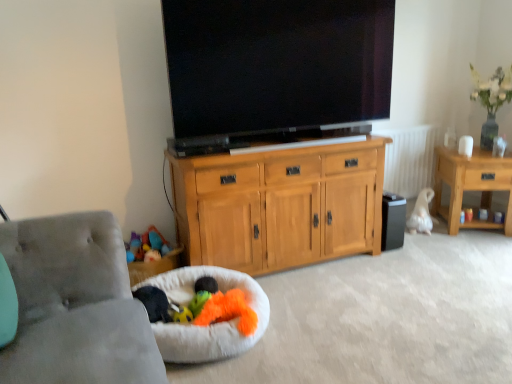
In order to face soft plush toy at lower center, acting as the 1th toy starting from the left, should I rotate leftwards or rightwards?

To align with it, rotate left about 9.523°.

Where is `soft plush toy at lower center, which is the third toy from right to left`? soft plush toy at lower center, which is the third toy from right to left is located at coordinates (180, 313).

Where is `wooden side table at right`? The width and height of the screenshot is (512, 384). wooden side table at right is located at coordinates (471, 185).

The height and width of the screenshot is (384, 512). Describe the element at coordinates (471, 185) in the screenshot. I see `wooden side table at right` at that location.

Image resolution: width=512 pixels, height=384 pixels. Describe the element at coordinates (498, 217) in the screenshot. I see `smooth plastic cup at right, marked as the first toy in a back-to-front arrangement` at that location.

Measure the distance between point (193, 169) and camera.

The depth of point (193, 169) is 7.48 feet.

Image resolution: width=512 pixels, height=384 pixels. Describe the element at coordinates (410, 158) in the screenshot. I see `white textured radiator at right` at that location.

This screenshot has width=512, height=384. What are the coordinates of `soft plush toy at lower center, acting as the 1th toy starting from the left` in the screenshot? It's located at (180, 313).

Image resolution: width=512 pixels, height=384 pixels. Identify the location of television in front of the fluffy orange toy at lower center, arranged as the second toy when viewed from the left. (276, 72).

Is the position of fluffy orange toy at lower center, which is the second toy from front to back, more distant than that of black glossy flat-screen tv at center?

Yes, fluffy orange toy at lower center, which is the second toy from front to back, is behind black glossy flat-screen tv at center.

Which point is more distant from viewer, (200, 285) or (336, 87)?

Point (336, 87)

Which object is wider, fluffy orange toy at lower center, the second toy when ordered from back to front, or black glossy flat-screen tv at center?

Wider between the two is black glossy flat-screen tv at center.

Which object is closer to the camera, soft plush toy at lower center, placed as the first toy when sorted from front to back, or white textured radiator at right?

soft plush toy at lower center, placed as the first toy when sorted from front to back, is in front.

From a real-world perspective, is soft plush toy at lower center, the 3th toy from the back, positioned above or below white textured radiator at right?

soft plush toy at lower center, the 3th toy from the back, is situated lower than white textured radiator at right in the real world.

From the image's perspective, relative to white textured radiator at right, is soft plush toy at lower center, acting as the 1th toy starting from the left, above or below?

From the image's perspective, soft plush toy at lower center, acting as the 1th toy starting from the left, appears below white textured radiator at right.

Is soft plush toy at lower center, marked as the 3th toy in a top-to-bottom arrangement, touching white textured radiator at right?

No, soft plush toy at lower center, marked as the 3th toy in a top-to-bottom arrangement, is not making contact with white textured radiator at right.

This screenshot has height=384, width=512. I want to click on animal directly beneath the black glossy flat-screen tv at center (from a real-world perspective), so click(421, 214).

Can you tell me how much black glossy flat-screen tv at center and white fluffy dog at right differ in facing direction?

The angular difference between black glossy flat-screen tv at center and white fluffy dog at right is 35.4 degrees.

Is white fluffy dog at right at the back of black glossy flat-screen tv at center?

No, black glossy flat-screen tv at center is not facing away from white fluffy dog at right.

Can you confirm if gray fabric studio couch at lower left is positioned to the left of black glossy flat-screen tv at center?

Indeed, gray fabric studio couch at lower left is positioned on the left side of black glossy flat-screen tv at center.

Is gray fabric studio couch at lower left in front of black glossy flat-screen tv at center?

Yes, gray fabric studio couch at lower left is closer to the camera.

From a real-world perspective, which is physically below, gray fabric studio couch at lower left or black glossy flat-screen tv at center?

gray fabric studio couch at lower left is physically lower.

Can you tell me how much gray fabric studio couch at lower left and black glossy flat-screen tv at center differ in facing direction?

There is a 91-degree angle between the facing directions of gray fabric studio couch at lower left and black glossy flat-screen tv at center.

Is white textured radiator at right located outside white fluffy dog at right?

white textured radiator at right is positioned outside white fluffy dog at right.

Considering the relative sizes of white textured radiator at right and white fluffy dog at right in the image provided, is white textured radiator at right wider than white fluffy dog at right?

Incorrect, the width of white textured radiator at right does not surpass that of white fluffy dog at right.

Are white textured radiator at right and white fluffy dog at right beside each other?

No, white textured radiator at right is not touching white fluffy dog at right.

Considering the relative sizes of light wood cabinet at center and fluffy orange toy at lower center, which ranks as the 2th toy in top-to-bottom order, in the image provided, is light wood cabinet at center wider than fluffy orange toy at lower center, which ranks as the 2th toy in top-to-bottom order,?

Yes.

From the image's perspective, relative to fluffy orange toy at lower center, which appears as the second toy when viewed from the right, is light wood cabinet at center above or below?

Clearly, from the image's perspective, light wood cabinet at center is above fluffy orange toy at lower center, which appears as the second toy when viewed from the right.

Is point (239, 210) closer or farther from the camera than point (195, 294)?

Point (239, 210) is positioned farther from the camera compared to point (195, 294).

Between smooth plastic cup at right, the 3th toy when ordered from front to back, and white fluffy dog bed at lower left, which one appears on the right side from the viewer's perspective?

smooth plastic cup at right, the 3th toy when ordered from front to back.

From a real-world perspective, relative to white fluffy dog bed at lower left, is smooth plastic cup at right, marked as the third toy in a left-to-right arrangement, vertically above or below?

smooth plastic cup at right, marked as the third toy in a left-to-right arrangement, is above white fluffy dog bed at lower left.

Is smooth plastic cup at right, the 3th toy when ordered from front to back, facing towards white fluffy dog bed at lower left?

Answer: No, smooth plastic cup at right, the 3th toy when ordered from front to back, does not turn towards white fluffy dog bed at lower left.

How many degrees apart are the facing directions of smooth plastic cup at right, the 3th toy when ordered from front to back, and white fluffy dog bed at lower left?

The angular difference between smooth plastic cup at right, the 3th toy when ordered from front to back, and white fluffy dog bed at lower left is 90.4 degrees.

Locate an element on the screen. the 2nd toy located beneath the black glossy flat-screen tv at center (from a real-world perspective) is located at coordinates (202, 294).

Locate an element on the screen. The image size is (512, 384). toy that is the 3rd one when counting downward from the white textured radiator at right (from the image's perspective) is located at coordinates (180, 313).

Considering their positions, is black plastic speaker at lower right positioned closer to black glossy flat-screen tv at center than fluffy orange toy at lower center, marked as the second toy in a bottom-to-top arrangement?

Based on the image, black plastic speaker at lower right appears to be nearer to black glossy flat-screen tv at center.

From the image, which object appears to be farther from white fluffy dog bed at lower left, black glossy flat-screen tv at center or fluffy orange toy at lower center, which is the second toy from front to back?

The object further to white fluffy dog bed at lower left is black glossy flat-screen tv at center.

Which object lies further to the anchor point soft plush toy at lower center, the first toy from the bottom, black plastic speaker at lower right or fluffy orange toy at lower center, which appears as the second toy when viewed from the right?

Based on the image, black plastic speaker at lower right appears to be further to soft plush toy at lower center, the first toy from the bottom.

Based on their spatial positions, is white textured radiator at right or black glossy flat-screen tv at center further from light wood cabinet at center?

The object further to light wood cabinet at center is white textured radiator at right.

Estimate the real-world distances between objects in this image. Which object is further from black plastic speaker at lower right, smooth plastic cup at right, acting as the 1th toy starting from the right, or black glossy flat-screen tv at center?

black glossy flat-screen tv at center is further to black plastic speaker at lower right.

From the image, which object appears to be farther from white textured radiator at right, gray fabric studio couch at lower left or light wood cabinet at center?

Based on the image, gray fabric studio couch at lower left appears to be further to white textured radiator at right.

Considering their positions, is soft plush toy at lower center, the first toy from the bottom, positioned further to black glossy flat-screen tv at center than light wood cabinet at center?

Among the two, soft plush toy at lower center, the first toy from the bottom, is located further to black glossy flat-screen tv at center.

Based on their spatial positions, is white fluffy dog bed at lower left or gray fabric studio couch at lower left further from white textured radiator at right?

The object further to white textured radiator at right is gray fabric studio couch at lower left.

Locate an element on the screen. This screenshot has width=512, height=384. radiator between white fluffy dog bed at lower left and wooden side table at right from left to right is located at coordinates (410, 158).

Where is `animal located between white textured radiator at right and wooden side table at right in the left-right direction`? animal located between white textured radiator at right and wooden side table at right in the left-right direction is located at coordinates (421, 214).

Find the location of a particular element. television between gray fabric studio couch at lower left and white textured radiator at right from front to back is located at coordinates (276, 72).

The height and width of the screenshot is (384, 512). I want to click on desk located between white fluffy dog bed at lower left and smooth plastic cup at right, positioned as the first toy in top-to-bottom order, in the left-right direction, so click(471, 185).